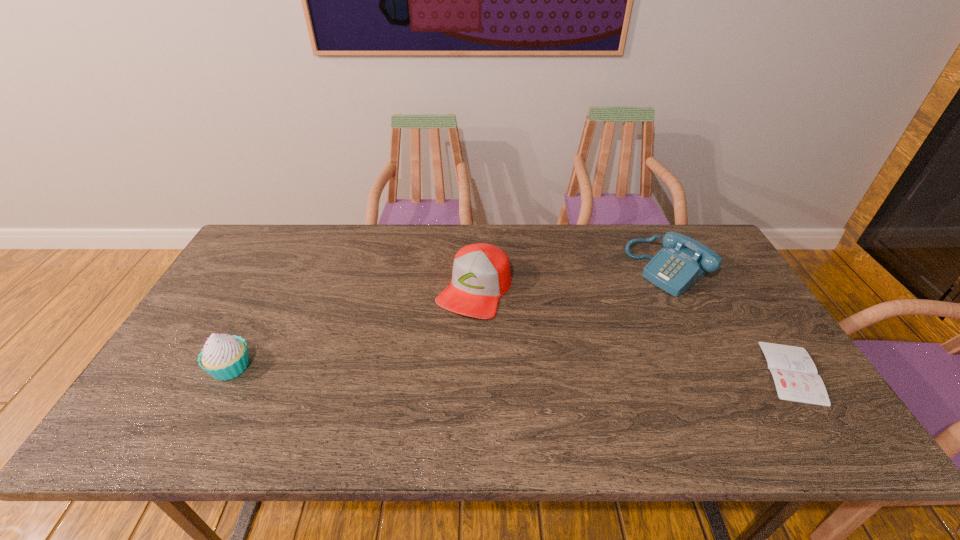
Where is `free spot located 0.170m on the front-facing side of the baseball cap`? free spot located 0.170m on the front-facing side of the baseball cap is located at coordinates (432, 364).

At what (x,y) coordinates should I click in order to perform the action: click on vacant point located 0.300m on the front-facing side of the baseball cap. Please return your answer as a coordinate pair (x, y). The height and width of the screenshot is (540, 960). Looking at the image, I should click on (407, 406).

The image size is (960, 540). Identify the location of telephone present at the far edge. [683, 261].

This screenshot has width=960, height=540. What are the coordinates of `baseball cap that is at the far edge` in the screenshot? It's located at (481, 274).

The width and height of the screenshot is (960, 540). Identify the location of cupcake situated at the near edge. (224, 357).

Where is `diary located in the near edge section of the desktop`? diary located in the near edge section of the desktop is located at coordinates (795, 375).

In order to click on object present at the left edge in this screenshot , I will do `click(224, 357)`.

Find the location of `diary that is at the right edge`. diary that is at the right edge is located at coordinates (795, 375).

Identify the location of telephone that is at the right edge. This screenshot has height=540, width=960. (683, 261).

This screenshot has width=960, height=540. In order to click on object situated at the near left corner in this screenshot , I will do `click(224, 357)`.